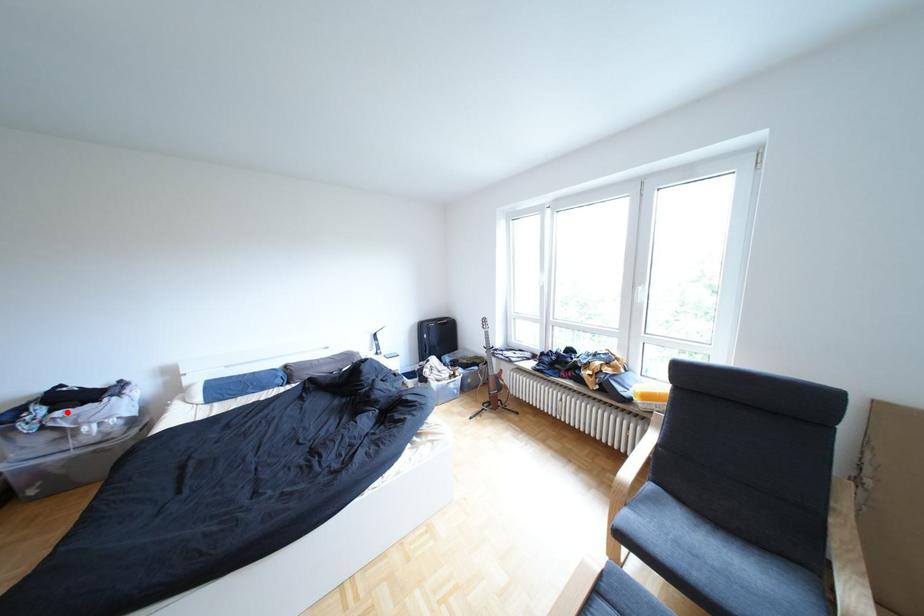
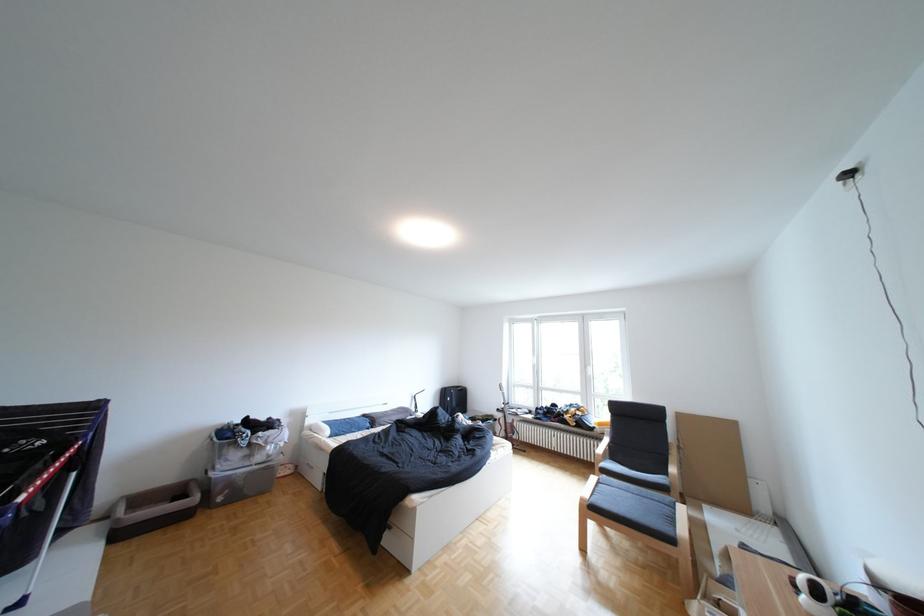
Locate, in the second image, the point that corresponds to the highlighted location in the first image.

(270, 434)